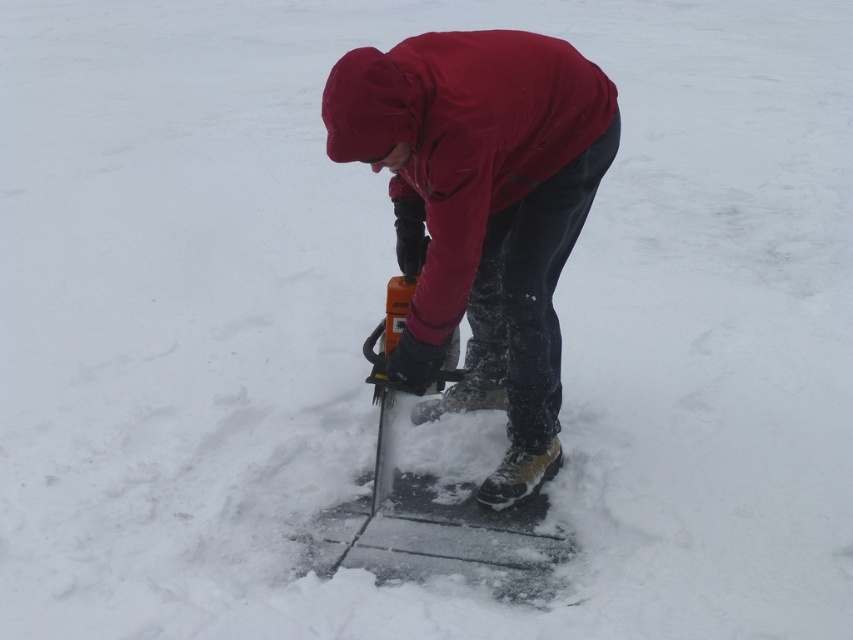
You are a photographer trying to capture the person in the scene. If you want to focus on the matte red jacket at center and the orange plastic saw at center, which object should you zoom in on to make sure both are clearly visible in the photo?

The matte red jacket at center is bigger than the orange plastic saw at center, so you should zoom in on the matte red jacket at center to ensure both objects are clearly visible.

You are a drone operator trying to capture a closeup of the person cutting snow with a chainsaw. The drone is currently at point (482, 211). The person is wearing a matte red jacket at center. Where should you move the drone to get a better shot of the person?

The person is wearing a matte red jacket at center, so you should move the drone closer to the center to capture a better shot of the person.

In the scene shown: You are a photographer trying to capture a clear shot of both the matte red jacket at center and the orange plastic saw at center. Since you want both to be in focus, which object should you focus on first to ensure both are sharp?

The matte red jacket at center is closer to the viewer than the orange plastic saw at center. To ensure both are in focus, you should focus on the matte red jacket at center first, as focusing on the closer object allows the background object to be in focus as well within the depth of field.